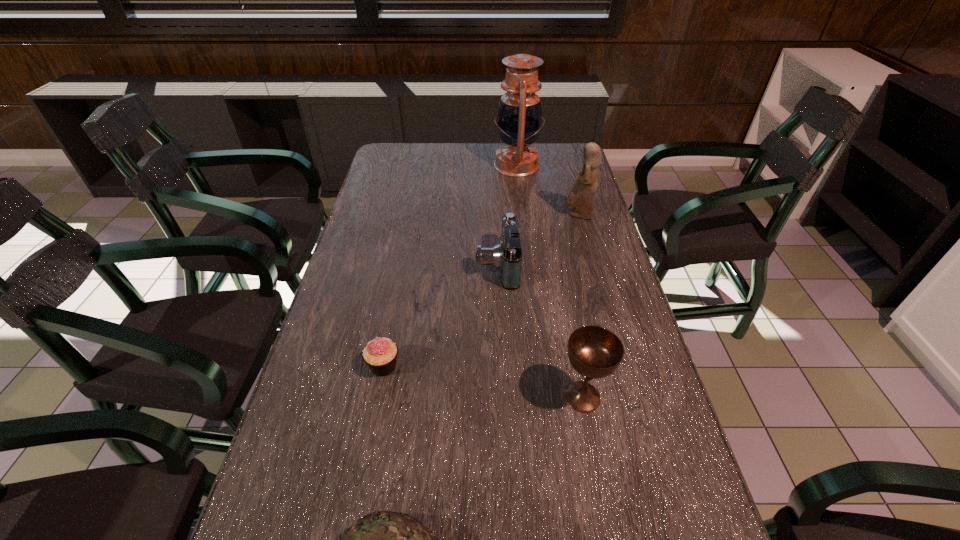
Find the location of a particular element. the tallest object is located at coordinates (519, 119).

At what (x,y) coordinates should I click in order to perform the action: click on oil lamp. Please return your answer as a coordinate pair (x, y). This screenshot has height=540, width=960. Looking at the image, I should click on pyautogui.click(x=519, y=119).

Where is `figurine`? figurine is located at coordinates (582, 195).

Where is `the fifth shortest object`? The image size is (960, 540). the fifth shortest object is located at coordinates coord(582,195).

Identify the location of the third tallest object. click(x=595, y=352).

This screenshot has height=540, width=960. I want to click on the third shortest object, so click(506, 256).

Where is `the third farthest object`? the third farthest object is located at coordinates (506, 256).

Where is `cupcake`? cupcake is located at coordinates (380, 354).

The width and height of the screenshot is (960, 540). What are the coordinates of `free region located on the left of the farthest object` in the screenshot? It's located at (428, 165).

The height and width of the screenshot is (540, 960). In order to click on vacant space located 0.130m on the front-facing side of the figurine in this screenshot , I will do `click(524, 215)`.